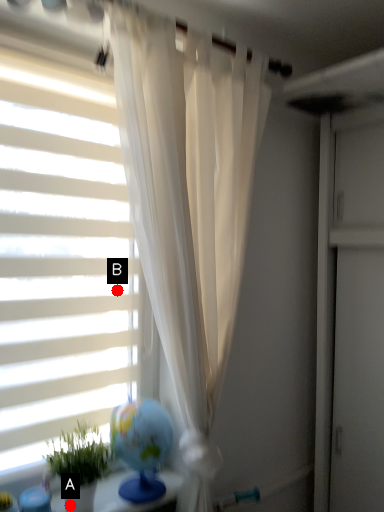
Question: Two points are circled on the image, labeled by A and B beside each circle. Which point is closer to the camera?

Choices:
 (A) A is closer
 (B) B is closer

Answer: (A)